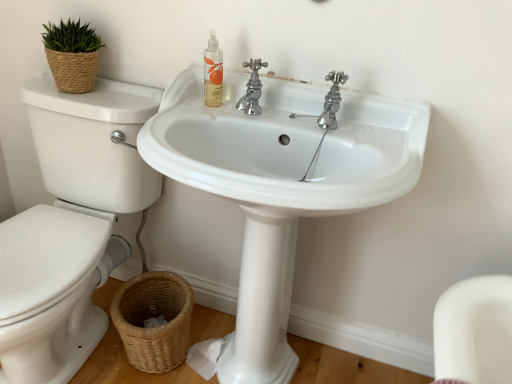
What is the approximate width of white glossy sink at center?

white glossy sink at center is 19.40 inches wide.

What is the approximate width of translucent plastic bottle at upper center?

translucent plastic bottle at upper center is 3.18 inches wide.

Image resolution: width=512 pixels, height=384 pixels. Identify the location of white glossy sink at center. (280, 186).

From the image's perspective, between woven brown basket at lower left and chrome metallic faucet at upper center, who is located below?

From the image's view, woven brown basket at lower left is below.

Which of these two, woven brown basket at lower left or chrome metallic faucet at upper center, is wider?

With larger width is woven brown basket at lower left.

Would you say woven brown basket at lower left is inside or outside chrome metallic faucet at upper center?

woven brown basket at lower left is not inside chrome metallic faucet at upper center, it's outside.

Is white glossy toilet at left touching translucent plastic bottle at upper center?

No, white glossy toilet at left is not next to translucent plastic bottle at upper center.

Can you confirm if white glossy toilet at left is shorter than translucent plastic bottle at upper center?

→ No.

Which point is more distant from viewer, (x=121, y=207) or (x=216, y=83)?

The point (x=121, y=207) is farther from the camera.

Would you say white glossy toilet at left contains translucent plastic bottle at upper center?

No.

Is chrome metallic faucet at upper center turned away from woven brown basket at lower left?

chrome metallic faucet at upper center does not have its back to woven brown basket at lower left.

Consider the image. Is chrome metallic faucet at upper center far away from woven brown basket at lower left?

That's not correct — chrome metallic faucet at upper center is a little close to woven brown basket at lower left.

Can you tell me how much chrome metallic faucet at upper center and woven brown basket at lower left differ in facing direction?

2.59 degrees separate the facing orientations of chrome metallic faucet at upper center and woven brown basket at lower left.

Is chrome metallic faucet at upper center outside of woven brown basket at lower left?

Yes.

Who is more distant, white glossy sink at center or woven brown basket at lower left?

Positioned behind is woven brown basket at lower left.

Which of these two, white glossy sink at center or woven brown basket at lower left, stands shorter?

woven brown basket at lower left is shorter.

Measure the distance from white glossy sink at center to woven brown basket at lower left.

white glossy sink at center and woven brown basket at lower left are 15.41 inches apart from each other.

Identify the location of basket on the left of white glossy sink at center. (154, 317).

Is point (217, 71) closer or farther from the camera than point (273, 159)?

Clearly, point (217, 71) is more distant from the camera than point (273, 159).

Is translucent plastic bottle at upper center beside white glossy sink at center?

They are not placed beside each other.

Where is `cleaning product behind the white glossy sink at center`? cleaning product behind the white glossy sink at center is located at coordinates (213, 73).

Consider the image. Considering the relative sizes of translucent plastic bottle at upper center and white glossy sink at center in the image provided, is translucent plastic bottle at upper center bigger than white glossy sink at center?

Incorrect, translucent plastic bottle at upper center is not larger than white glossy sink at center.

Is chrome metallic faucet at upper center to the right of translucent plastic bottle at upper center from the viewer's perspective?

Indeed, chrome metallic faucet at upper center is positioned on the right side of translucent plastic bottle at upper center.

Based on the photo, which of these two, chrome metallic faucet at upper center or translucent plastic bottle at upper center, stands shorter?

Standing shorter between the two is chrome metallic faucet at upper center.

Would you consider chrome metallic faucet at upper center to be distant from translucent plastic bottle at upper center?

That's not correct — chrome metallic faucet at upper center is a little close to translucent plastic bottle at upper center.

Is white glossy toilet at left facing away from woven brown basket at lower left?

No, woven brown basket at lower left is not at the back of white glossy toilet at left.

Is the surface of white glossy toilet at left in direct contact with woven brown basket at lower left?

No, white glossy toilet at left is not touching woven brown basket at lower left.

Who is more distant, white glossy toilet at left or woven brown basket at lower left?

Positioned behind is woven brown basket at lower left.

Is white glossy toilet at left wider or thinner than woven brown basket at lower left?

Clearly, white glossy toilet at left has more width compared to woven brown basket at lower left.

Find the location of a particular element. The height and width of the screenshot is (384, 512). tap above the woven brown basket at lower left (from the image's perspective) is located at coordinates (329, 102).

Find the location of a particular element. The image size is (512, 384). cleaning product behind the white glossy toilet at left is located at coordinates (213, 73).

When comparing their distances from translucent plastic bottle at upper center, does woven brown basket at lower left or chrome metallic faucet at upper center seem further?

Among the two, woven brown basket at lower left is located further to translucent plastic bottle at upper center.

Based on their spatial positions, is white glossy toilet at left or woven brown basket at lower left further from chrome metallic faucet at upper center?

woven brown basket at lower left is further to chrome metallic faucet at upper center.

Looking at the image, which one is located closer to woven brown basket at lower left, white glossy toilet at left or white glossy sink at center?

Among the two, white glossy toilet at left is located nearer to woven brown basket at lower left.

From the picture: Considering their positions, is translucent plastic bottle at upper center positioned closer to chrome metallic faucet at upper center than white glossy sink at center?

translucent plastic bottle at upper center is positioned closer to the anchor chrome metallic faucet at upper center.

Based on their spatial positions, is white glossy sink at center or translucent plastic bottle at upper center further from chrome metallic faucet at upper center?

white glossy sink at center.

Estimate the real-world distances between objects in this image. Which object is further from white glossy sink at center, woven brown basket at lower left or translucent plastic bottle at upper center?

Among the two, woven brown basket at lower left is located further to white glossy sink at center.

Looking at the image, which one is located closer to white glossy sink at center, white glossy toilet at left or chrome metallic faucet at upper center?

The object closer to white glossy sink at center is chrome metallic faucet at upper center.

Estimate the real-world distances between objects in this image. Which object is further from chrome metallic faucet at upper center, woven brown basket at lower left or white glossy toilet at left?

woven brown basket at lower left lies further to chrome metallic faucet at upper center than the other object.

The width and height of the screenshot is (512, 384). I want to click on basket situated between white glossy toilet at left and white glossy sink at center from left to right, so click(154, 317).

Find the location of `toilet between translucent plastic bottle at upper center and woven brown basket at lower left from top to bottom`. toilet between translucent plastic bottle at upper center and woven brown basket at lower left from top to bottom is located at coordinates [71, 226].

Where is `cleaning product situated between white glossy toilet at left and white glossy sink at center from left to right`? This screenshot has width=512, height=384. cleaning product situated between white glossy toilet at left and white glossy sink at center from left to right is located at coordinates (213, 73).

Where is `basket located between white glossy toilet at left and chrome metallic faucet at upper center in the left-right direction`? The width and height of the screenshot is (512, 384). basket located between white glossy toilet at left and chrome metallic faucet at upper center in the left-right direction is located at coordinates (154, 317).